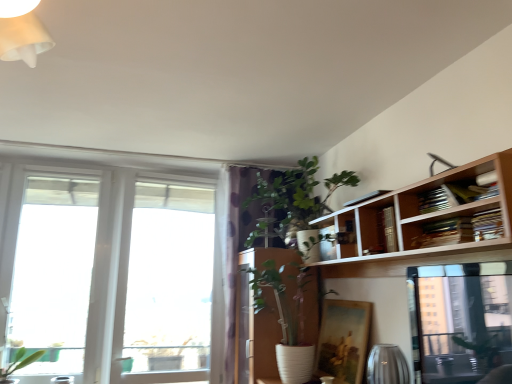
Question: Does green leafy plant at upper center have a lesser width compared to transparent glass window at left, which is counted as the 2th window, starting from the right?

Choices:
 (A) no
 (B) yes

Answer: (A)

Question: Considering the relative positions of green leafy plant at upper center and transparent glass window at left, the 1th window viewed from the left, in the image provided, is green leafy plant at upper center to the left of transparent glass window at left, the 1th window viewed from the left, from the viewer's perspective?

Choices:
 (A) no
 (B) yes

Answer: (A)

Question: From a real-world perspective, is green leafy plant at upper center under transparent glass window at left, the 1th window viewed from the left?

Choices:
 (A) no
 (B) yes

Answer: (A)

Question: Does green leafy plant at upper center have a smaller size compared to transparent glass window at left, which is counted as the 2th window, starting from the right?

Choices:
 (A) no
 (B) yes

Answer: (A)

Question: Is the position of green leafy plant at upper center less distant than that of transparent glass window at left, the 1th window viewed from the left?

Choices:
 (A) yes
 (B) no

Answer: (A)

Question: From a real-world perspective, is wooden bookshelf at upper right above or below green leafy plant at upper center?

Choices:
 (A) above
 (B) below

Answer: (B)

Question: Visually, is wooden bookshelf at upper right positioned to the left or to the right of green leafy plant at upper center?

Choices:
 (A) right
 (B) left

Answer: (A)

Question: Is wooden bookshelf at upper right in front of or behind green leafy plant at upper center in the image?

Choices:
 (A) behind
 (B) front

Answer: (B)

Question: From their relative heights in the image, would you say wooden bookshelf at upper right is taller or shorter than green leafy plant at upper center?

Choices:
 (A) short
 (B) tall

Answer: (A)

Question: In terms of size, does transparent glass window at left, which is counted as the 2th window, starting from the right, appear bigger or smaller than purple dotted fabric at center?

Choices:
 (A) small
 (B) big

Answer: (A)

Question: Would you say transparent glass window at left, the 1th window viewed from the left, is inside or outside purple dotted fabric at center?

Choices:
 (A) inside
 (B) outside

Answer: (B)

Question: From a real-world perspective, is transparent glass window at left, which is counted as the 2th window, starting from the right, positioned above or below purple dotted fabric at center?

Choices:
 (A) above
 (B) below

Answer: (A)

Question: Is transparent glass window at left, which is counted as the 2th window, starting from the right, in front of or behind purple dotted fabric at center in the image?

Choices:
 (A) front
 (B) behind

Answer: (A)

Question: Is green leafy plant at upper center situated inside wooden bookshelf at upper right or outside?

Choices:
 (A) inside
 (B) outside

Answer: (B)

Question: Is point (316, 195) positioned closer to the camera than point (448, 172)?

Choices:
 (A) farther
 (B) closer

Answer: (A)